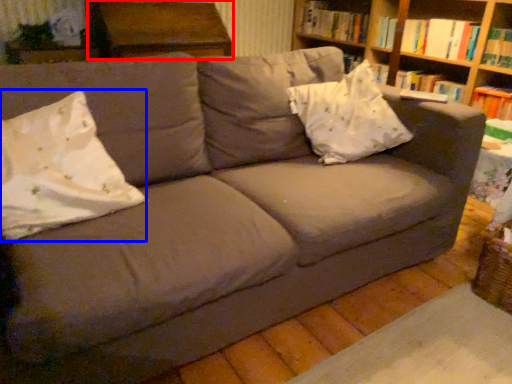
Question: Which point is further to the camera, table (highlighted by a red box) or throw pillow (highlighted by a blue box)?

Choices:
 (A) table
 (B) throw pillow

Answer: (A)